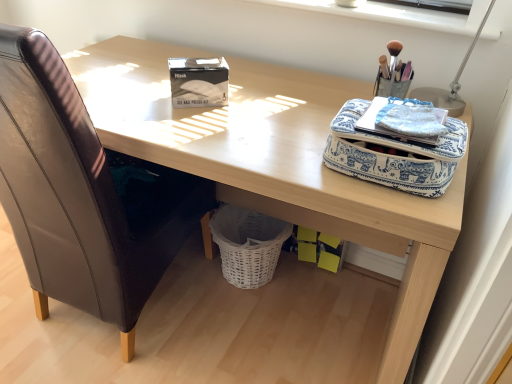
This screenshot has width=512, height=384. What are the coordinates of `free area in between metallic silver table lamp at upper right and white matte gel nail polish kit at upper center` in the screenshot? It's located at (290, 102).